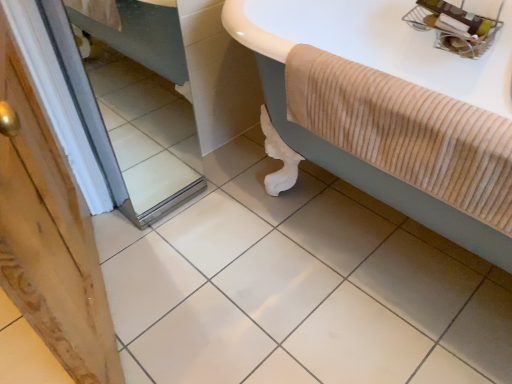
Question: Considering the relative positions of mirror at left and beige corduroy bathtub at upper right in the image provided, is mirror at left to the left of beige corduroy bathtub at upper right from the viewer's perspective?

Choices:
 (A) no
 (B) yes

Answer: (B)

Question: Would you say mirror at left contains beige corduroy bathtub at upper right?

Choices:
 (A) no
 (B) yes

Answer: (A)

Question: Can you confirm if mirror at left is shorter than beige corduroy bathtub at upper right?

Choices:
 (A) yes
 (B) no

Answer: (B)

Question: Is mirror at left oriented away from beige corduroy bathtub at upper right?

Choices:
 (A) yes
 (B) no

Answer: (B)

Question: Is mirror at left closer to the viewer compared to beige corduroy bathtub at upper right?

Choices:
 (A) no
 (B) yes

Answer: (A)

Question: Can you confirm if mirror at left is smaller than beige corduroy bathtub at upper right?

Choices:
 (A) no
 (B) yes

Answer: (A)

Question: Is mirror at left taller than white glossy ceramic tile at center?

Choices:
 (A) yes
 (B) no

Answer: (A)

Question: Could you tell me if mirror at left is turned towards white glossy ceramic tile at center?

Choices:
 (A) no
 (B) yes

Answer: (B)

Question: Is the depth of mirror at left greater than that of white glossy ceramic tile at center?

Choices:
 (A) no
 (B) yes

Answer: (B)

Question: From a real-world perspective, does mirror at left sit lower than white glossy ceramic tile at center?

Choices:
 (A) no
 (B) yes

Answer: (A)

Question: Is mirror at left positioned in front of white glossy ceramic tile at center?

Choices:
 (A) yes
 (B) no

Answer: (B)

Question: From the image's perspective, does mirror at left appear higher than white glossy ceramic tile at center?

Choices:
 (A) yes
 (B) no

Answer: (A)

Question: Could you tell me if white glossy ceramic tile at center is turned towards beige corduroy bathtub at upper right?

Choices:
 (A) no
 (B) yes

Answer: (A)